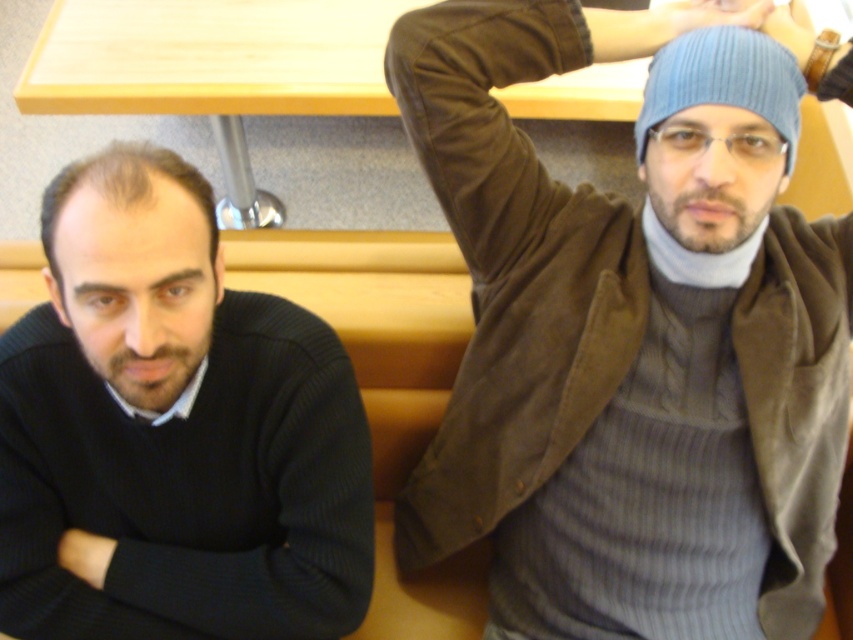
You are standing in a cafe and want to hand a menu to the person wearing the matte black sweater at left. If you are 1 meter away from them, can you reach them without moving closer?

The matte black sweater at left and viewer are 79.25 centimeters apart from each other, which is less than 1 meter. Therefore, you are already within reaching distance and can hand the menu without moving closer.

You are a fashion designer observing two people in an image. You notice the ribbed knit sweater at upper right and the black ribbed sweater at left. Which sweater appears taller in the image?

The ribbed knit sweater at upper right appears much taller than the black ribbed sweater at left in the image.